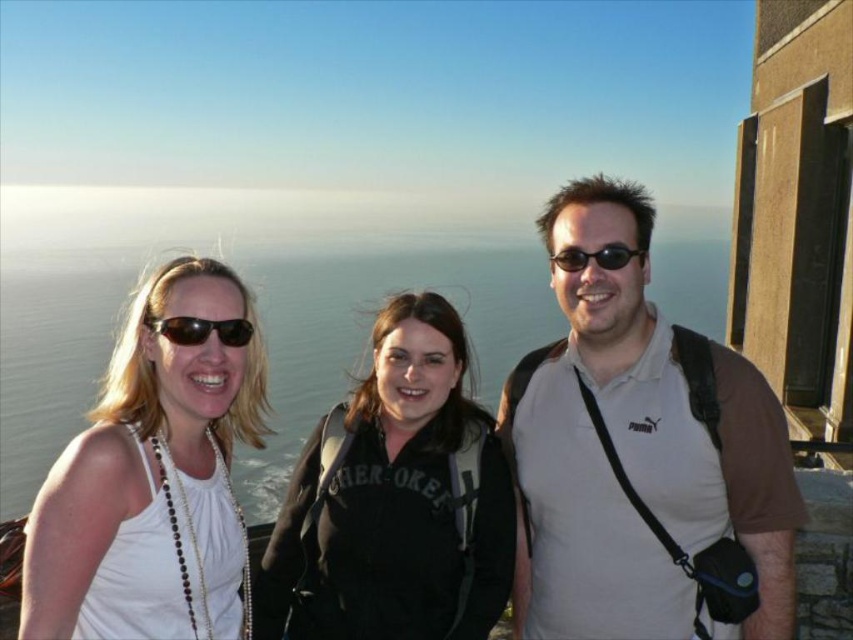
You are a photographer trying to capture a candid shot of the two people wearing sunglasses at the scenic overlook. Since you want to ensure both pairs of sunglasses are visible in the frame, which direction should you position your camera relative to the matte black sunglasses at center and the black plastic sunglasses at center?

You should position your camera to the right of the matte black sunglasses at center because it is to the left of the black plastic sunglasses at center, so angling the camera to the right will keep both pairs in view.

You are a photographer trying to capture a clear shot of the black matte jacket at center and the matte black sunglasses at center. Since the sunglasses are in front of the jacket, will you need to adjust your focus to ensure both are in focus?

The matte black sunglasses at center is behind the black matte jacket at center, so the sunglasses are actually behind the jacket. This means they are not blocking the jacket, so you can focus on both without needing to adjust for overlapping objects.